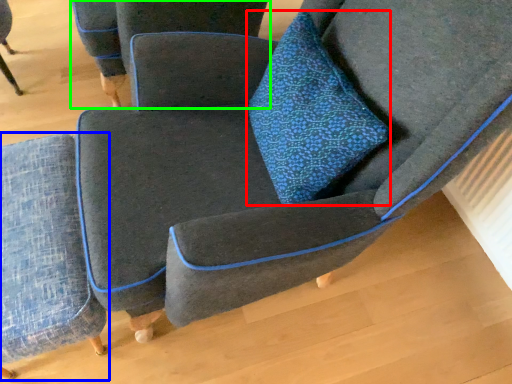
Question: Which object is the closest to the throw pillow (highlighted by a red box)? Choose among these: chair (highlighted by a blue box) or chair (highlighted by a green box).

Choices:
 (A) chair
 (B) chair

Answer: (A)